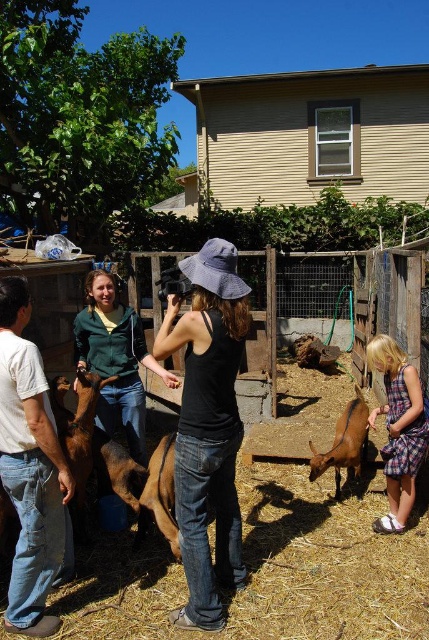
Question: Which point appears farthest from the camera in this image?

Choices:
 (A) (117, 371)
 (B) (338, 465)
 (C) (99, 458)
 (D) (71, 429)

Answer: (B)

Question: Does brown fuzzy goat at left have a greater width compared to brown furry dog at center?

Choices:
 (A) yes
 (B) no

Answer: (B)

Question: Which object is the farthest from the brown fuzzy goat at left?

Choices:
 (A) brown furry goat at lower center
 (B) white cotton shirt at left
 (C) green fleece vest at center

Answer: (A)

Question: Which object is positioned farthest from the brown fuzzy goat at left?

Choices:
 (A) green fleece vest at center
 (B) brown fur dog at center
 (C) brown furry dog at center

Answer: (B)

Question: Considering the relative positions of brown furry goat at lower center and brown furry dog at center in the image provided, where is brown furry goat at lower center located with respect to brown furry dog at center?

Choices:
 (A) left
 (B) right

Answer: (B)

Question: Does green fleece vest at center appear on the left side of brown furry dog at center?

Choices:
 (A) no
 (B) yes

Answer: (B)